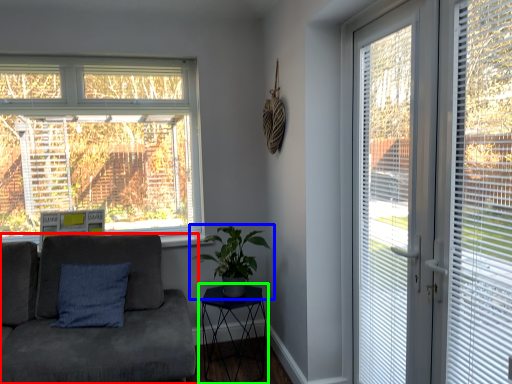
Question: Estimate the real-world distances between objects in this image. Which object is farther from studio couch (highlighted by a red box), houseplant (highlighted by a blue box) or table (highlighted by a green box)?

Choices:
 (A) houseplant
 (B) table

Answer: (B)